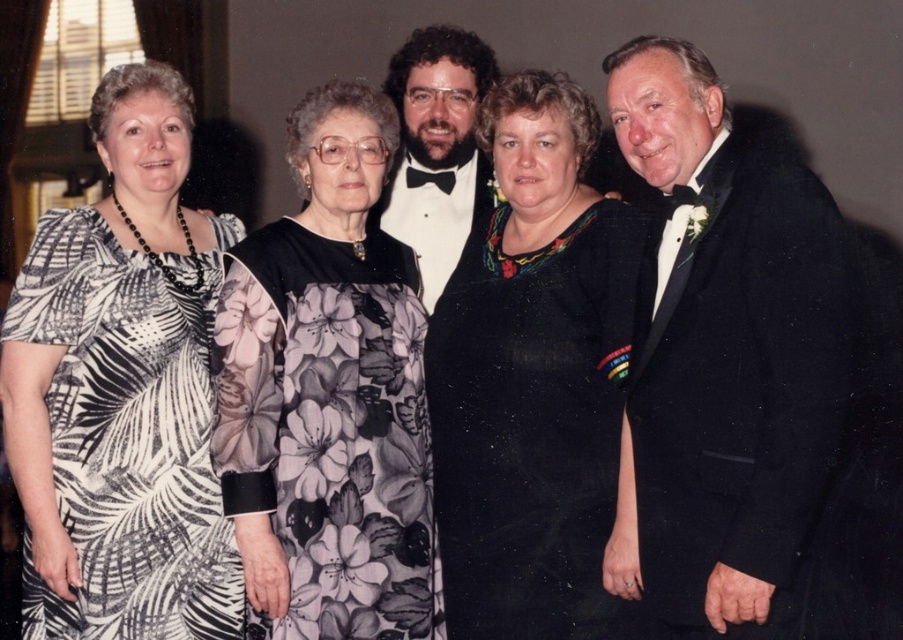
Find the location of a particular element. This screenshot has height=640, width=903. black wool suit at right is located at coordinates click(x=725, y=362).

Does black wool suit at right have a greater width compared to printed fabric dress at left?

Answer: No, black wool suit at right is not wider than printed fabric dress at left.

Is point (755, 458) farther from camera compared to point (166, 284)?

No, (755, 458) is in front of (166, 284).

Image resolution: width=903 pixels, height=640 pixels. Identify the location of black wool suit at right. (725, 362).

Where is `black matte dress at center`? black matte dress at center is located at coordinates (532, 378).

Does point (447, 525) come behind point (463, 64)?

No.

You are a GUI agent. You are given a task and a screenshot of the screen. Output one action in this format:
    pyautogui.click(x=<x>, y=<y>)
    Task: Click on the black matte dress at center
    
    Given the screenshot: What is the action you would take?
    pyautogui.click(x=532, y=378)

Is black matte dress at center to the right of printed fabric dress at left from the viewer's perspective?

Yes, black matte dress at center is to the right of printed fabric dress at left.

This screenshot has height=640, width=903. What do you see at coordinates (532, 378) in the screenshot? I see `black matte dress at center` at bounding box center [532, 378].

The width and height of the screenshot is (903, 640). Identify the location of black matte dress at center. (532, 378).